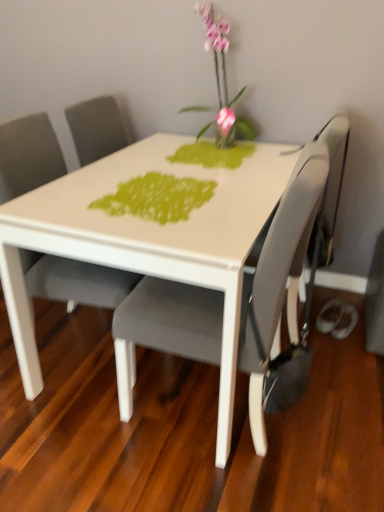
Identify the location of matte gray swivel chair at right. The image size is (384, 512). (333, 179).

Based on the photo, what is the approximate width of green textured placemat at center?

It is 18.97 inches.

Where is `matte gray chair at center, acting as the first chair starting from the right`? The height and width of the screenshot is (512, 384). matte gray chair at center, acting as the first chair starting from the right is located at coordinates (277, 275).

Where is `matte gray chair at center, the first chair in the left-to-right sequence`? This screenshot has height=512, width=384. matte gray chair at center, the first chair in the left-to-right sequence is located at coordinates (75, 280).

From the picture: Between matte gray swivel chair at right and matte gray chair at center, the first chair in the left-to-right sequence, which one has larger width?

matte gray chair at center, the first chair in the left-to-right sequence, is wider.

From a real-world perspective, is matte gray swivel chair at right positioned above or below matte gray chair at center, arranged as the 2th chair when viewed from the right?

Clearly, from a real-world perspective, matte gray swivel chair at right is above matte gray chair at center, arranged as the 2th chair when viewed from the right.

Which of these two, matte gray chair at center, the 2th chair viewed from the left, or matte gray swivel chair at right, stands taller?

matte gray chair at center, the 2th chair viewed from the left.

Is the surface of matte gray chair at center, acting as the first chair starting from the right, in direct contact with matte gray swivel chair at right?

matte gray chair at center, acting as the first chair starting from the right, and matte gray swivel chair at right are not in contact.

Is matte gray chair at center, the 2th chair viewed from the left, at the right side of matte gray swivel chair at right?

In fact, matte gray chair at center, the 2th chair viewed from the left, is to the left of matte gray swivel chair at right.

From the image's perspective, which is above, green textured placemat at center or matte gray swivel chair at right?

matte gray swivel chair at right is shown above in the image.

Consider the image. What's the angular difference between green textured placemat at center and matte gray swivel chair at right's facing directions?

There is a 20.8-degree angle between the facing directions of green textured placemat at center and matte gray swivel chair at right.

Which object is closer to the camera, green textured placemat at center or matte gray swivel chair at right?

green textured placemat at center is closer to the camera.

Is green textured placemat at center oriented away from matte gray swivel chair at right?

No.

From a real-world perspective, who is located higher, matte gray swivel chair at right or matte gray chair at center, the 2th chair viewed from the left?

matte gray swivel chair at right, from a real-world perspective.

Is matte gray swivel chair at right far away from matte gray chair at center, acting as the first chair starting from the right?

That's not correct — matte gray swivel chair at right is a little close to matte gray chair at center, acting as the first chair starting from the right.

Can you tell me how much matte gray swivel chair at right and matte gray chair at center, acting as the first chair starting from the right, differ in facing direction?

The angle between the facing direction of matte gray swivel chair at right and the facing direction of matte gray chair at center, acting as the first chair starting from the right, is 69.2 degrees.

Considering the relative positions of matte gray swivel chair at right and matte gray chair at center, acting as the first chair starting from the right, in the image provided, is matte gray swivel chair at right behind matte gray chair at center, acting as the first chair starting from the right,?

Yes, matte gray swivel chair at right is further from the viewer.

Between point (31, 272) and point (161, 281), which one is positioned behind?

The point (31, 272) is behind.

Is matte gray chair at center, the first chair in the left-to-right sequence, at the right side of matte gray chair at center, the 2th chair viewed from the left?

No.

In the scene shown: Looking at the image, does matte gray chair at center, arranged as the 2th chair when viewed from the right, seem bigger or smaller compared to matte gray chair at center, the 2th chair viewed from the left?

matte gray chair at center, arranged as the 2th chair when viewed from the right, is smaller than matte gray chair at center, the 2th chair viewed from the left.

Is green textured placemat at center positioned before pink glass vase at upper center?

Yes, green textured placemat at center is closer to the camera.

Can you confirm if green textured placemat at center is smaller than pink glass vase at upper center?

Yes, green textured placemat at center is smaller than pink glass vase at upper center.

Is point (146, 188) in front of point (226, 84)?

Yes, it is in front of point (226, 84).

Is green textured placemat at center taller than pink glass vase at upper center?

Incorrect, the height of green textured placemat at center is not larger of that of pink glass vase at upper center.

Where is `chair that is in front of the green textured placemat at center`? chair that is in front of the green textured placemat at center is located at coordinates (277, 275).

From a real-world perspective, between matte gray chair at center, acting as the first chair starting from the right, and green textured placemat at center, who is vertically lower?

From a 3D spatial view, matte gray chair at center, acting as the first chair starting from the right, is below.

Which point is more distant from viewer, (147, 283) or (154, 187)?

Positioned behind is point (154, 187).

Considering the relative sizes of matte gray chair at center, the 2th chair viewed from the left, and green textured placemat at center in the image provided, is matte gray chair at center, the 2th chair viewed from the left, smaller than green textured placemat at center?

Incorrect, matte gray chair at center, the 2th chair viewed from the left, is not smaller in size than green textured placemat at center.

You are a GUI agent. You are given a task and a screenshot of the screen. Output one action in this format:
    pyautogui.click(x=<x>, y=<y>)
    Task: Click on the swivel chair above the matte gray chair at center, arranged as the 2th chair when viewed from the right (from the image's perspective)
    
    Given the screenshot: What is the action you would take?
    pyautogui.click(x=333, y=179)

Where is `chair that is the 2nd one below the matte gray swivel chair at right (from a real-world perspective)`? chair that is the 2nd one below the matte gray swivel chair at right (from a real-world perspective) is located at coordinates click(277, 275).

Which object lies further to the anchor point green textured placemat at center, pink glass vase at upper center or matte gray chair at center, arranged as the 2th chair when viewed from the right?

pink glass vase at upper center is further to green textured placemat at center.

Considering their positions, is matte gray chair at center, the 2th chair viewed from the left, positioned further to pink glass vase at upper center than matte gray swivel chair at right?

Based on the image, matte gray chair at center, the 2th chair viewed from the left, appears to be further to pink glass vase at upper center.

From the picture: Based on their spatial positions, is pink glass vase at upper center or matte gray swivel chair at right further from matte gray chair at center, the 2th chair viewed from the left?

Based on the image, pink glass vase at upper center appears to be further to matte gray chair at center, the 2th chair viewed from the left.

When comparing their distances from matte gray chair at center, arranged as the 2th chair when viewed from the right, does pink glass vase at upper center or green textured placemat at center seem closer?

Based on the image, green textured placemat at center appears to be nearer to matte gray chair at center, arranged as the 2th chair when viewed from the right.

Considering their positions, is matte gray swivel chair at right positioned further to matte gray chair at center, acting as the first chair starting from the right, than pink glass vase at upper center?

pink glass vase at upper center is further to matte gray chair at center, acting as the first chair starting from the right.

Looking at the image, which one is located closer to matte gray chair at center, arranged as the 2th chair when viewed from the right, matte gray chair at center, acting as the first chair starting from the right, or pink glass vase at upper center?

matte gray chair at center, acting as the first chair starting from the right, lies closer to matte gray chair at center, arranged as the 2th chair when viewed from the right, than the other object.

Estimate the real-world distances between objects in this image. Which object is closer to pink glass vase at upper center, matte gray chair at center, acting as the first chair starting from the right, or matte gray chair at center, the first chair in the left-to-right sequence?

Among the two, matte gray chair at center, the first chair in the left-to-right sequence, is located nearer to pink glass vase at upper center.

Considering their positions, is matte gray chair at center, the 2th chair viewed from the left, positioned further to green textured placemat at center than matte gray swivel chair at right?

matte gray swivel chair at right.

Where is `chair between pink glass vase at upper center and matte gray chair at center, the 2th chair viewed from the left, from top to bottom`? This screenshot has height=512, width=384. chair between pink glass vase at upper center and matte gray chair at center, the 2th chair viewed from the left, from top to bottom is located at coordinates (75, 280).

The height and width of the screenshot is (512, 384). I want to click on design located between matte gray chair at center, the first chair in the left-to-right sequence, and matte gray swivel chair at right in the left-right direction, so coord(157,197).

Identify the location of design between matte gray chair at center, acting as the first chair starting from the right, and matte gray swivel chair at right in the front-back direction. The height and width of the screenshot is (512, 384). (157, 197).

This screenshot has height=512, width=384. I want to click on design between matte gray chair at center, the first chair in the left-to-right sequence, and matte gray chair at center, acting as the first chair starting from the right, in the horizontal direction, so click(x=157, y=197).